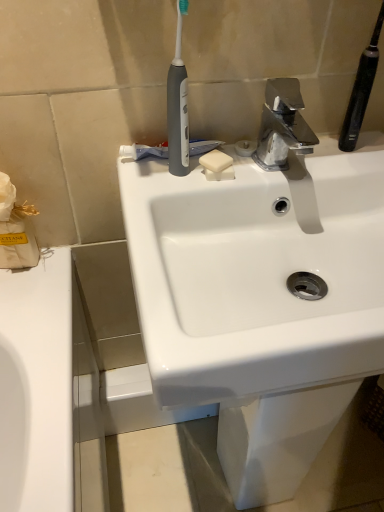
The height and width of the screenshot is (512, 384). In order to click on vacant space to the left of white matte soap at center in this screenshot , I will do `click(160, 168)`.